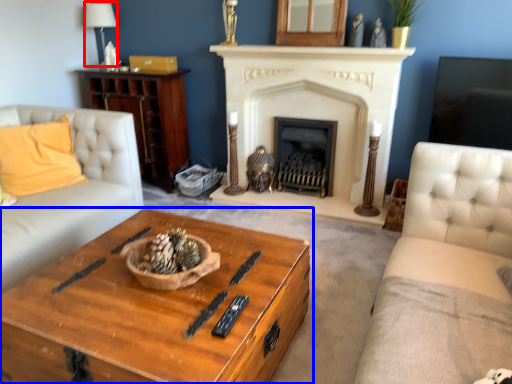
Question: Which point is further to the camera, lamp (highlighted by a red box) or coffee table (highlighted by a blue box)?

Choices:
 (A) lamp
 (B) coffee table

Answer: (A)